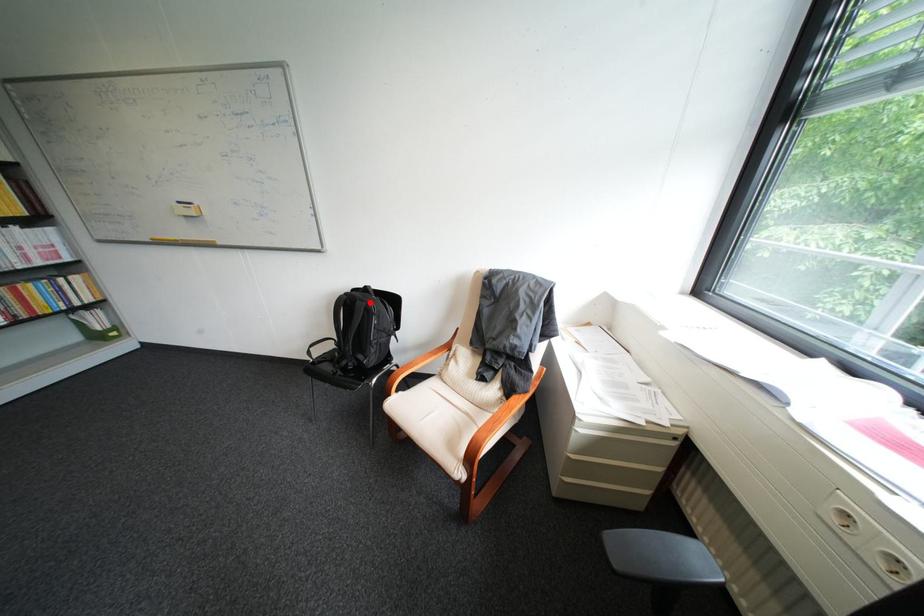
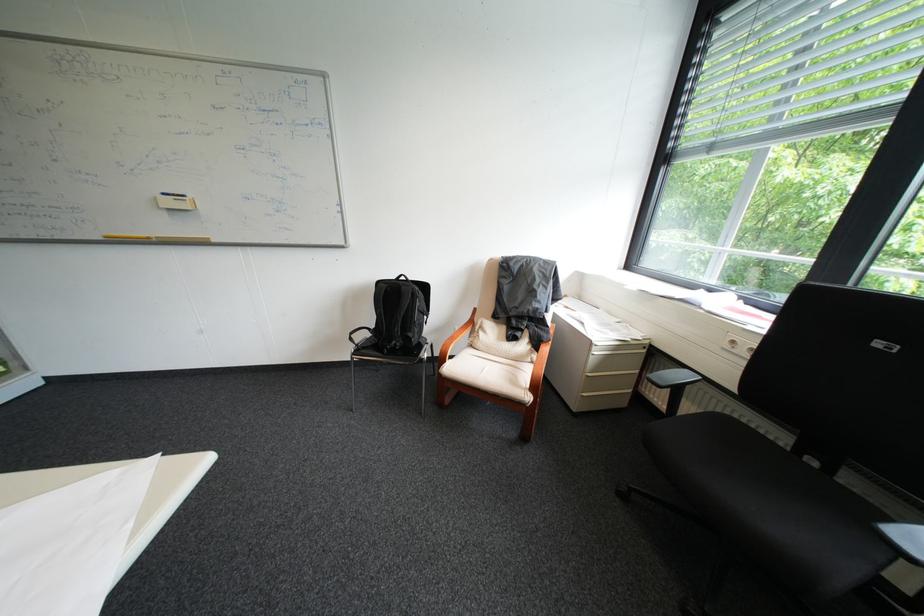
Where in the second image is the point corresponding to the highlighted location from the first image?

(415, 288)